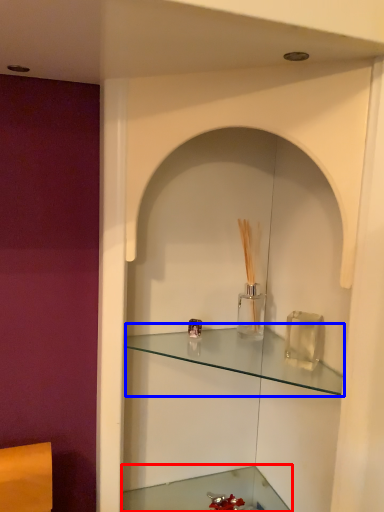
Question: Which of the following is the closest to the observer, cabinetry (highlighted by a red box) or shelf (highlighted by a blue box)?

Choices:
 (A) cabinetry
 (B) shelf

Answer: (B)